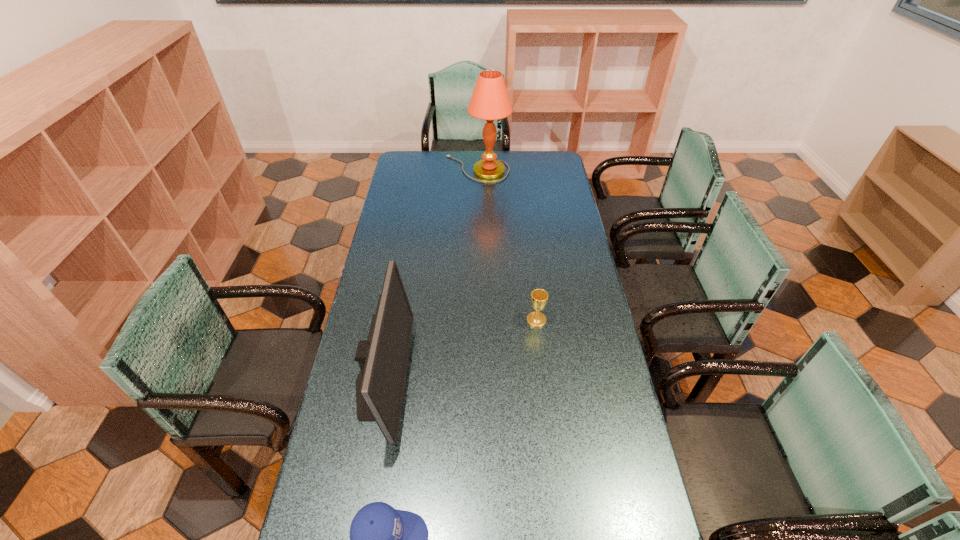
This screenshot has width=960, height=540. I want to click on object that stands as the closest to the nearest object, so click(x=383, y=358).

Identify the location of free space in the image that satisfies the following two spatial constraints: 1. on the front side of the second shortest object; 2. on the screen side of the third shortest object. (543, 381).

Find the location of `free space that satisfies the following two spatial constraints: 1. on the front side of the third tallest object; 2. on the left side of the tallest object`. free space that satisfies the following two spatial constraints: 1. on the front side of the third tallest object; 2. on the left side of the tallest object is located at coordinates (476, 320).